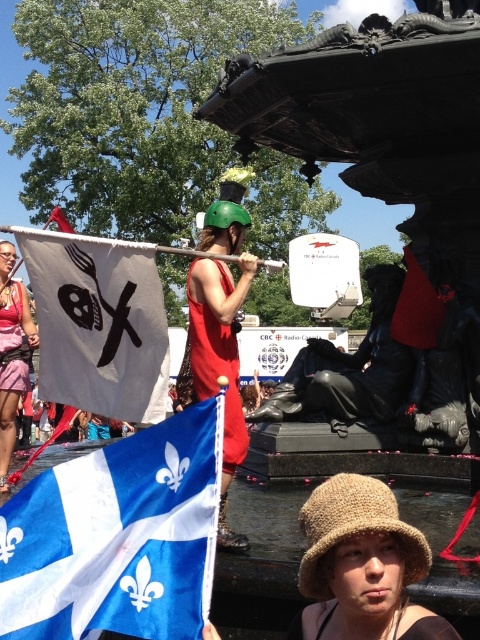
Who is taller, leather jacket at center or pink fabric dress at left?

pink fabric dress at left

Is leather jacket at center shorter than pink fabric dress at left?

Correct, leather jacket at center is not as tall as pink fabric dress at left.

Is point (368, 368) positioned in front of point (10, 250)?

Yes, point (368, 368) is in front of point (10, 250).

The height and width of the screenshot is (640, 480). In order to click on leather jacket at center in this screenshot , I will do `click(348, 369)`.

Is the position of matte red tank top at center less distant than that of pink fabric dress at left?

Yes, matte red tank top at center is in front of pink fabric dress at left.

Locate an element on the screen. matte red tank top at center is located at coordinates (219, 362).

In the scene shown: Between blue fabric flag at lower left and leather jacket at center, which one appears on the left side from the viewer's perspective?

Positioned to the left is blue fabric flag at lower left.

Between blue fabric flag at lower left and leather jacket at center, which one has less height?

Standing shorter between the two is blue fabric flag at lower left.

Locate an element on the screen. blue fabric flag at lower left is located at coordinates (117, 536).